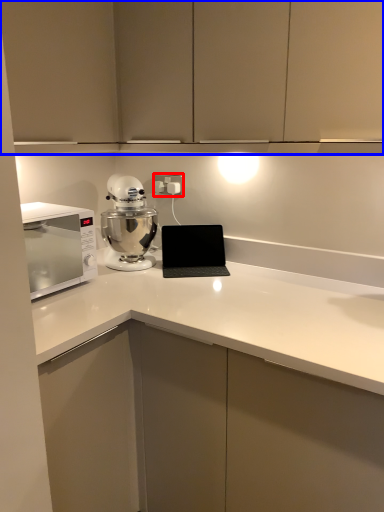
Question: Among these objects, which one is nearest to the camera, electric outlet (highlighted by a red box) or cabinetry (highlighted by a blue box)?

Choices:
 (A) electric outlet
 (B) cabinetry

Answer: (B)